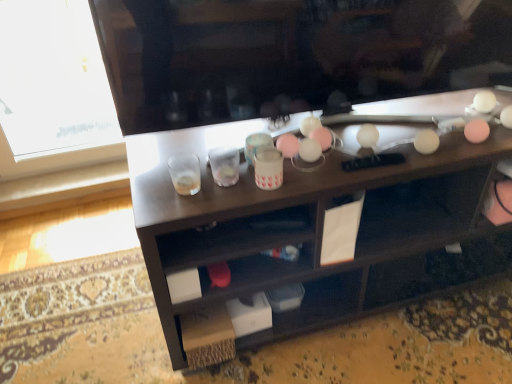
Question: Is translucent glass at center, which ranks as the second shot glass in right-to-left order, next to pink matte cup at center and touching it?

Choices:
 (A) yes
 (B) no

Answer: (B)

Question: Is translucent glass at center, placed as the first shot glass when sorted from left to right, completely or partially outside of pink matte cup at center?

Choices:
 (A) yes
 (B) no

Answer: (A)

Question: Considering the relative sizes of translucent glass at center, which ranks as the second shot glass in right-to-left order, and pink matte cup at center in the image provided, is translucent glass at center, which ranks as the second shot glass in right-to-left order, thinner than pink matte cup at center?

Choices:
 (A) no
 (B) yes

Answer: (B)

Question: Does translucent glass at center, which ranks as the second shot glass in right-to-left order, have a greater height compared to pink matte cup at center?

Choices:
 (A) no
 (B) yes

Answer: (A)

Question: Is translucent glass at center, which ranks as the second shot glass in right-to-left order, aimed at pink matte cup at center?

Choices:
 (A) yes
 (B) no

Answer: (B)

Question: Is translucent glass at center, which ranks as the second shot glass in right-to-left order, in front of or behind pink matte cup at center in the image?

Choices:
 (A) front
 (B) behind

Answer: (B)

Question: In terms of size, does translucent glass at center, placed as the first shot glass when sorted from left to right, appear bigger or smaller than pink matte cup at center?

Choices:
 (A) small
 (B) big

Answer: (A)

Question: Considering the positions of point (186, 168) and point (264, 150), is point (186, 168) closer or farther from the camera than point (264, 150)?

Choices:
 (A) closer
 (B) farther

Answer: (B)

Question: Considering the positions of translucent glass at center, which ranks as the second shot glass in right-to-left order, and pink matte cup at center in the image, is translucent glass at center, which ranks as the second shot glass in right-to-left order, wider or thinner than pink matte cup at center?

Choices:
 (A) wide
 (B) thin

Answer: (B)

Question: From the image's perspective, is pink matte cup at center located above or below clear plastic shot glass at center, the 1th shot glass from the right?

Choices:
 (A) above
 (B) below

Answer: (B)

Question: Is pink matte cup at center to the left or to the right of clear plastic shot glass at center, the 1th shot glass from the right, in the image?

Choices:
 (A) right
 (B) left

Answer: (A)

Question: In terms of width, does pink matte cup at center look wider or thinner when compared to clear plastic shot glass at center, the 1th shot glass from the right?

Choices:
 (A) thin
 (B) wide

Answer: (B)

Question: From their relative heights in the image, would you say pink matte cup at center is taller or shorter than clear plastic shot glass at center, the 1th shot glass from the right?

Choices:
 (A) tall
 (B) short

Answer: (B)

Question: Do you think pink matte cup at center is within translucent glass at center, which ranks as the second shot glass in right-to-left order, or outside of it?

Choices:
 (A) inside
 (B) outside

Answer: (B)

Question: Would you say pink matte cup at center is to the left or to the right of translucent glass at center, which ranks as the second shot glass in right-to-left order, in the picture?

Choices:
 (A) right
 (B) left

Answer: (A)